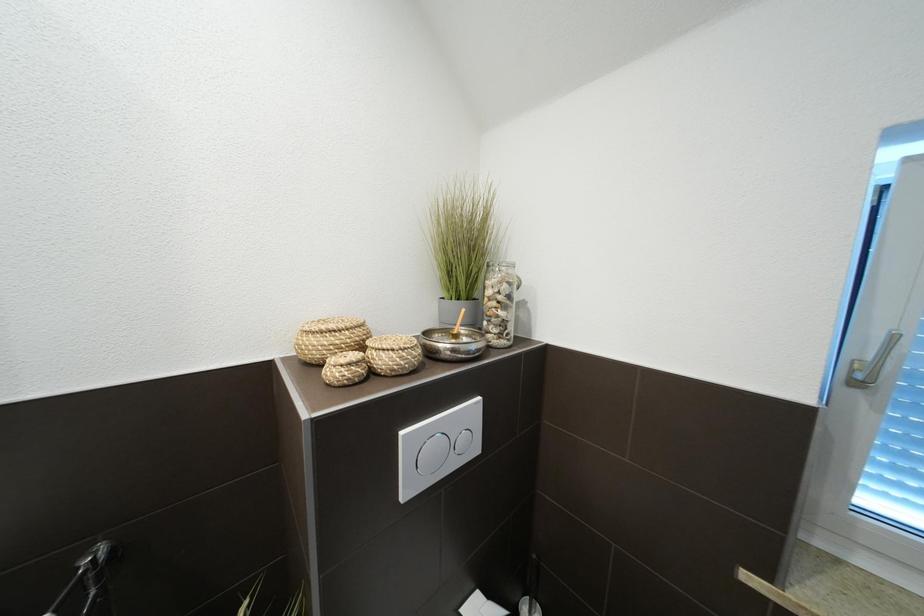
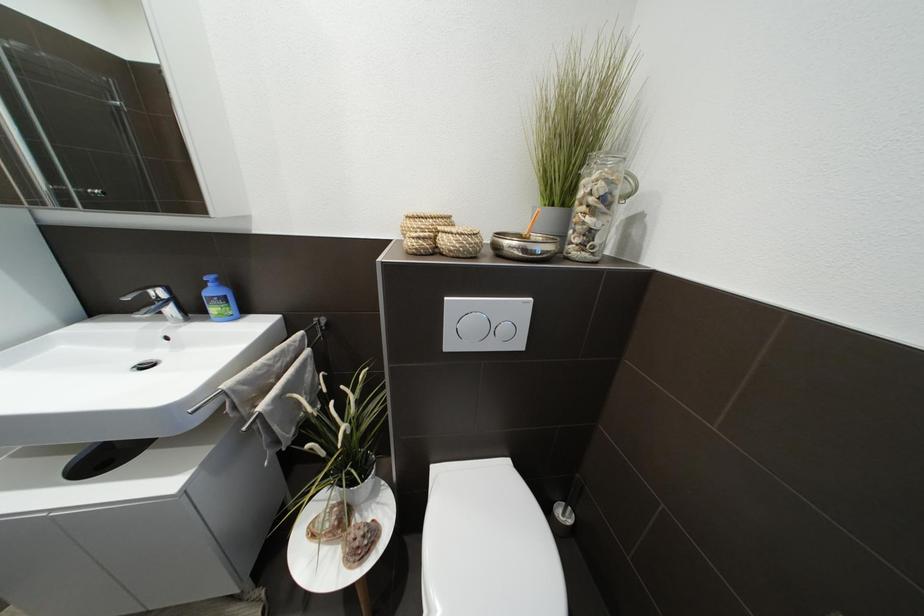
Based on the photo, the images are taken continuously from a first-person perspective. In which direction is your viewpoint rotating?

The camera's rotation is toward left-down.